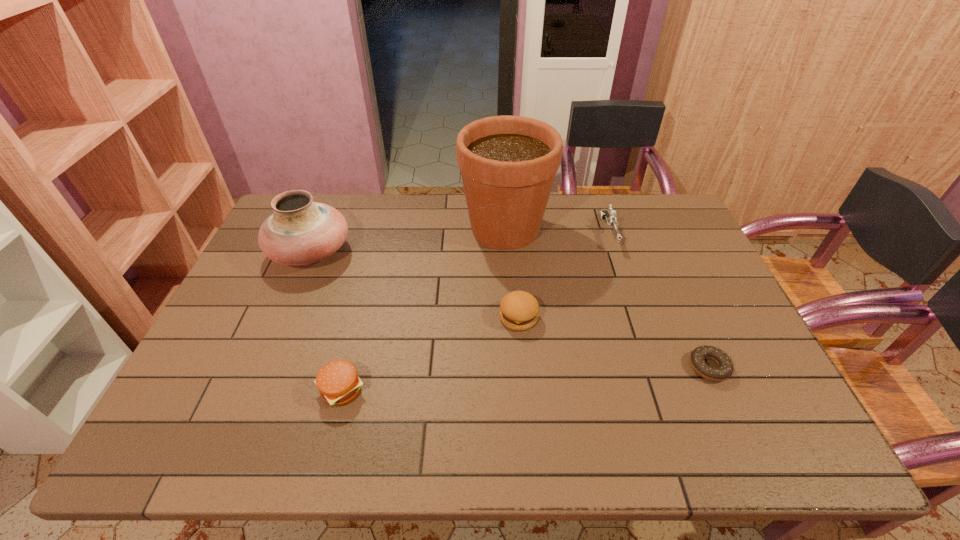
This screenshot has width=960, height=540. In order to click on flowerpot in this screenshot , I will do `click(508, 164)`.

Identify the location of pottery. (300, 231).

Find the location of a particular element. This screenshot has width=960, height=540. the fifth shortest object is located at coordinates (300, 231).

This screenshot has width=960, height=540. In order to click on the third tallest object in this screenshot , I will do (610, 216).

This screenshot has height=540, width=960. Find the location of `the second object from right to left`. the second object from right to left is located at coordinates (610, 216).

Identify the location of the farther hamburger. (519, 310).

I want to click on the fourth farthest object, so click(519, 310).

In order to click on the left hamburger in this screenshot , I will do `click(338, 383)`.

Where is `the fifth object from right to left`? Image resolution: width=960 pixels, height=540 pixels. the fifth object from right to left is located at coordinates (338, 383).

Find the location of a particular element. the shortest object is located at coordinates (724, 370).